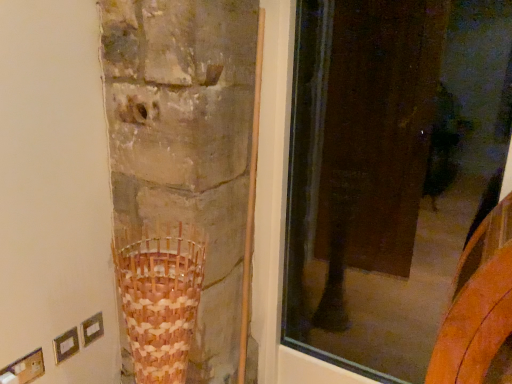
What is the approximate height of brown woven basket at lower center?

22.39 inches.

This screenshot has height=384, width=512. Describe the element at coordinates (159, 296) in the screenshot. I see `brown woven basket at lower center` at that location.

Locate an element on the screen. This screenshot has height=384, width=512. brown woven basket at lower center is located at coordinates [159, 296].

Locate an element on the screen. The image size is (512, 384). brown woven basket at lower center is located at coordinates (159, 296).